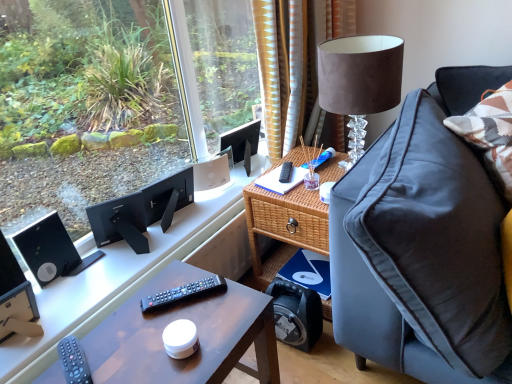
Locate an element on the screen. vacant space behind matte black remote control at lower left, which is counted as the third remote control, starting from the right is located at coordinates (112, 323).